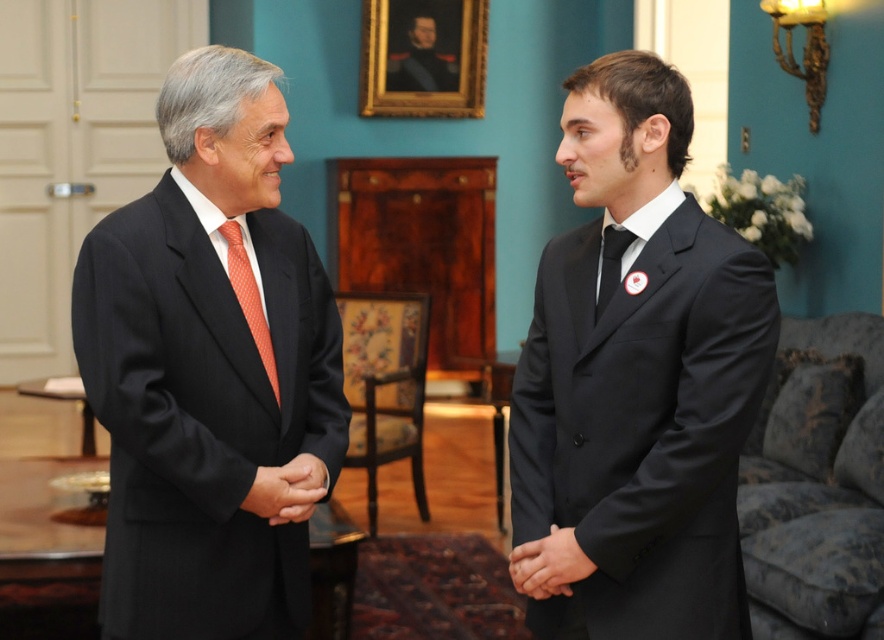
Does black satin suit at right have a smaller size compared to black smooth hand at center?

No, black satin suit at right is not smaller than black smooth hand at center.

Can you confirm if black satin suit at right is positioned above black smooth hand at center?

Indeed, black satin suit at right is positioned over black smooth hand at center.

At what (x,y) coordinates should I click in order to perform the action: click on black satin suit at right. Please return your answer as a coordinate pair (x, y). This screenshot has height=640, width=884. Looking at the image, I should click on (639, 376).

This screenshot has height=640, width=884. I want to click on black satin suit at right, so click(x=639, y=376).

Who is more distant from viewer, (521, 544) or (435, 76)?

Point (435, 76)

Between black smooth hands at center and dark blue uniform at upper center, which one has less height?

Standing shorter between the two is black smooth hands at center.

Which is in front, point (578, 564) or point (448, 67)?

Positioned in front is point (578, 564).

Image resolution: width=884 pixels, height=640 pixels. I want to click on black smooth hands at center, so click(547, 564).

Can you confirm if matte black suit at center is positioned to the left of black satin suit at right?

Yes, matte black suit at center is to the left of black satin suit at right.

Does point (116, 632) lie behind point (654, 467)?

Yes, point (116, 632) is farther from viewer.

Describe the element at coordinates (208, 365) in the screenshot. Image resolution: width=884 pixels, height=640 pixels. I see `matte black suit at center` at that location.

I want to click on matte black suit at center, so pos(208,365).